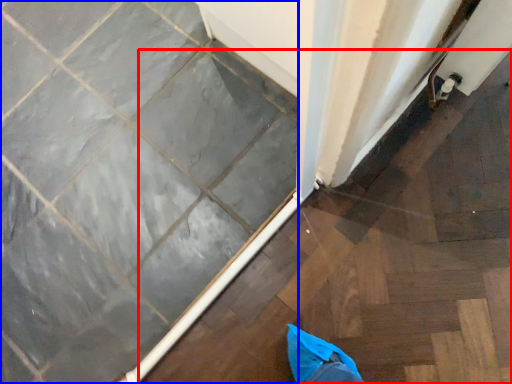
Question: Which object appears closest to the camera in this image, stairwell (highlighted by a red box) or ceramic tile (highlighted by a blue box)?

Choices:
 (A) stairwell
 (B) ceramic tile

Answer: (A)